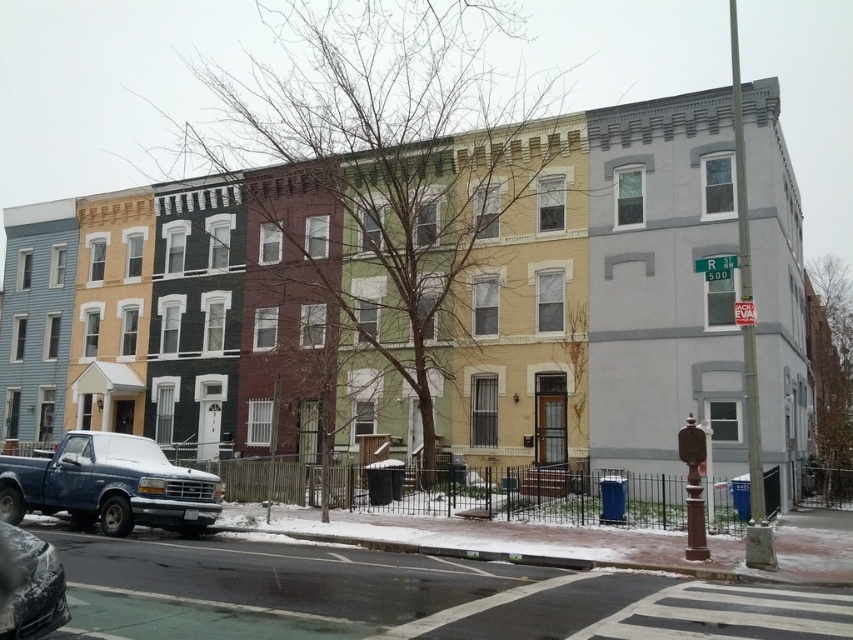
Is point (148, 474) farther from viewer compared to point (64, 621)?

Yes, point (148, 474) is farther from viewer.

Identify the location of blue matte truck at lower left. The image size is (853, 640). (109, 484).

I want to click on blue matte truck at lower left, so click(x=109, y=484).